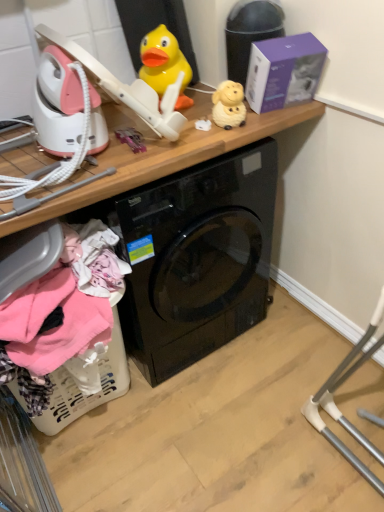
Where is `spots to the right of white plastic laundry basket at lower left`? spots to the right of white plastic laundry basket at lower left is located at coordinates (194, 409).